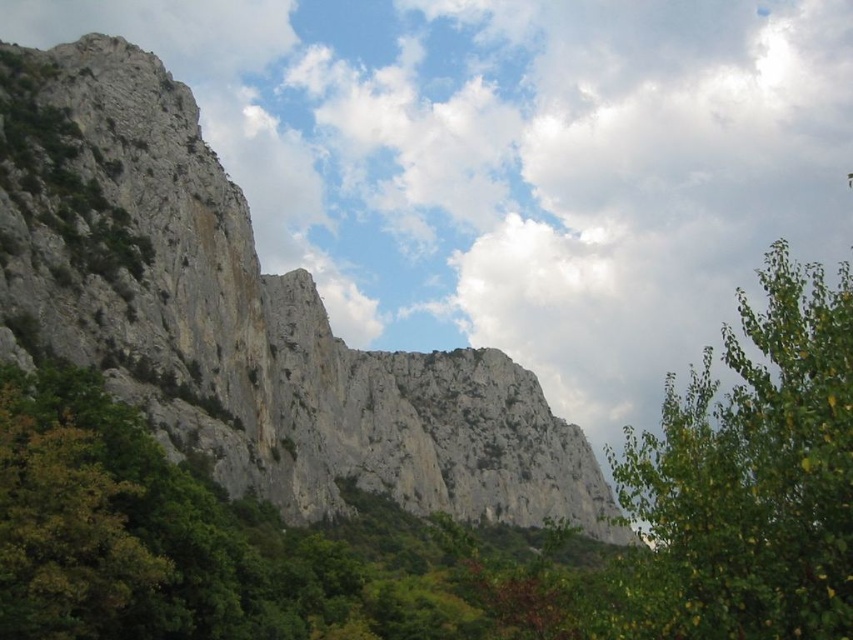
Is gray rock at center positioned in front of green leafy tree at upper right?

No, it is not.

Does gray rock at center have a greater width compared to green leafy tree at upper right?

No.

Is point (526, 474) positioned before point (659, 484)?

No, it is behind (659, 484).

At what (x,y) coordinates should I click in order to perform the action: click on gray rock at center. Please return your answer as a coordinate pair (x, y). This screenshot has height=640, width=853. Looking at the image, I should click on coord(242,317).